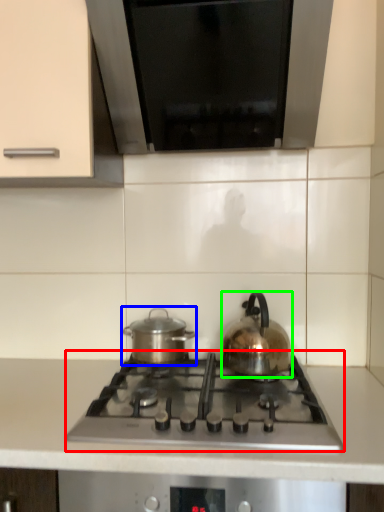
Question: Considering the real-world distances, which object is closest to gas stove (highlighted by a red box)? kitchen appliance (highlighted by a blue box) or kettle (highlighted by a green box).

Choices:
 (A) kitchen appliance
 (B) kettle

Answer: (B)